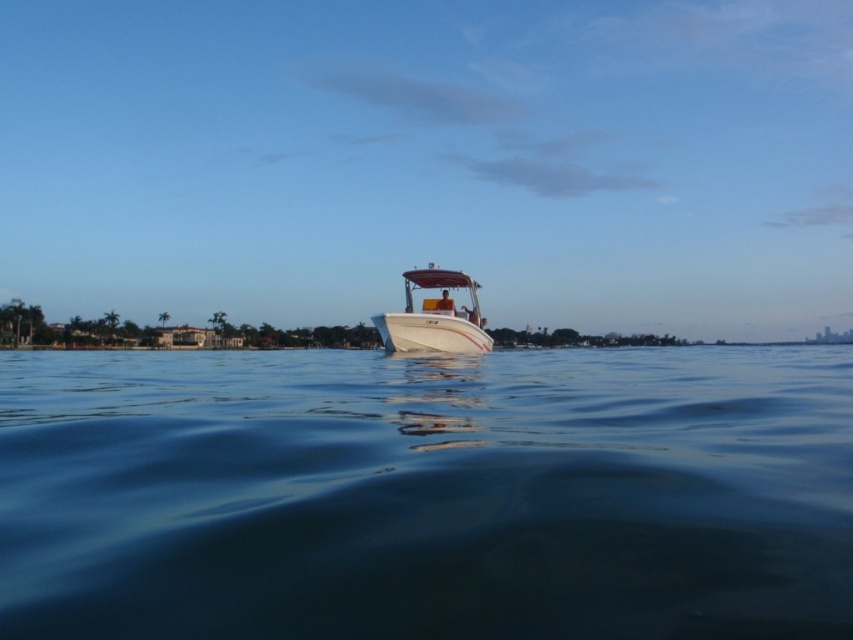
Question: Which point is farther to the camera?

Choices:
 (A) (589, 570)
 (B) (428, 346)

Answer: (B)

Question: Considering the relative positions of clear blue water at center and white glossy boat at center in the image provided, where is clear blue water at center located with respect to white glossy boat at center?

Choices:
 (A) left
 (B) right

Answer: (B)

Question: Which of the following is the farthest from the observer?

Choices:
 (A) (524, 408)
 (B) (387, 323)

Answer: (B)

Question: Is clear blue water at center to the left of white glossy boat at center from the viewer's perspective?

Choices:
 (A) no
 (B) yes

Answer: (A)

Question: Where is clear blue water at center located in relation to white glossy boat at center in the image?

Choices:
 (A) right
 (B) left

Answer: (A)

Question: Which of the following is the farthest from the observer?

Choices:
 (A) (157, 564)
 (B) (416, 314)

Answer: (B)